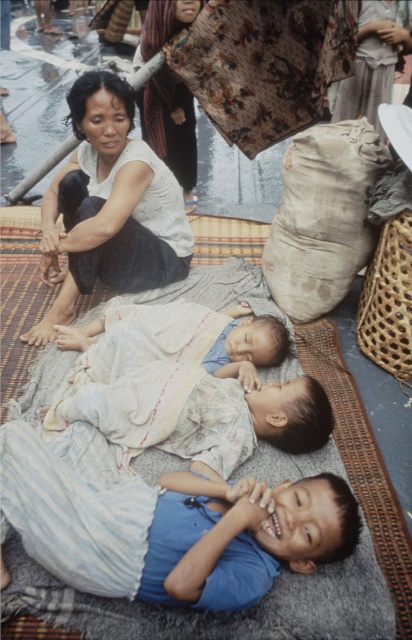
You are a photographer standing at the center of the frame. You want to take a photo of the white cotton shirt at upper left. Which direction should you move to get it in the frame?

You should move to the left and upwards to get the white cotton shirt at upper left in the frame since it is located at point (109, 208).

You are a photographer trying to capture the light blue fabric at center and the matte brown scarf at upper center in a single shot. Considering their sizes, which object should you focus on first to ensure both are in frame?

The light blue fabric at center is smaller than the matte brown scarf at upper center. To ensure both are in frame, focus on the larger matte brown scarf at upper center first, then adjust the camera angle to include the smaller light blue fabric at center.